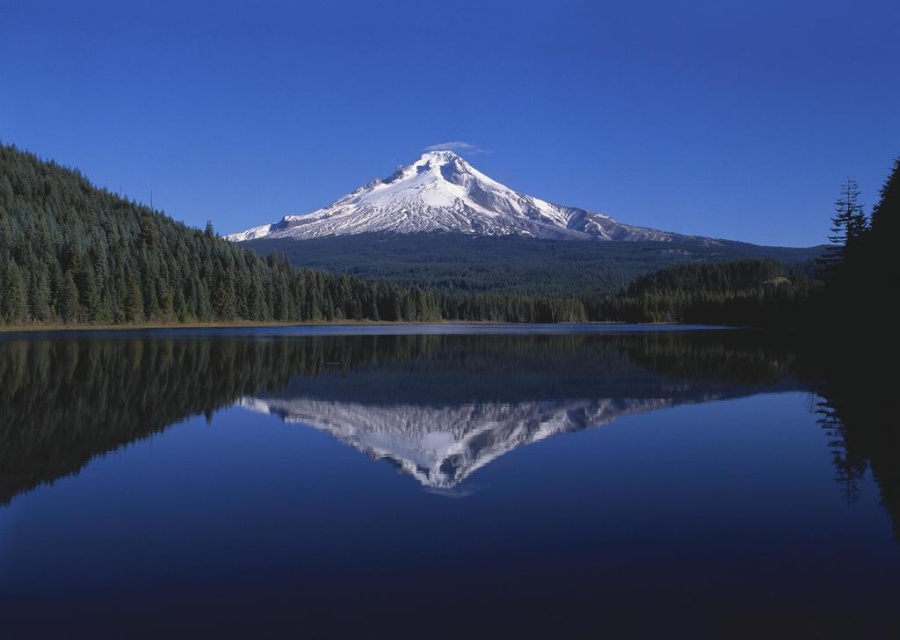
Question: Is transparent glass water at center positioned at the back of green matte tree at upper right?

Choices:
 (A) no
 (B) yes

Answer: (A)

Question: Considering the real-world distances, which object is closest to the transparent glass water at center?

Choices:
 (A) green matte tree at upper right
 (B) white snow-covered mountain at center

Answer: (A)

Question: Which is farther from the white snow-covered mountain at center?

Choices:
 (A) green matte tree at upper right
 (B) transparent glass water at center

Answer: (A)

Question: Can you confirm if white snow-covered mountain at center is positioned to the right of green matte tree at upper right?

Choices:
 (A) no
 (B) yes

Answer: (A)

Question: Can you confirm if transparent glass water at center is wider than white snow-covered mountain at center?

Choices:
 (A) no
 (B) yes

Answer: (A)

Question: Which object appears farthest from the camera in this image?

Choices:
 (A) white snow-covered mountain at center
 (B) green matte tree at upper right

Answer: (A)